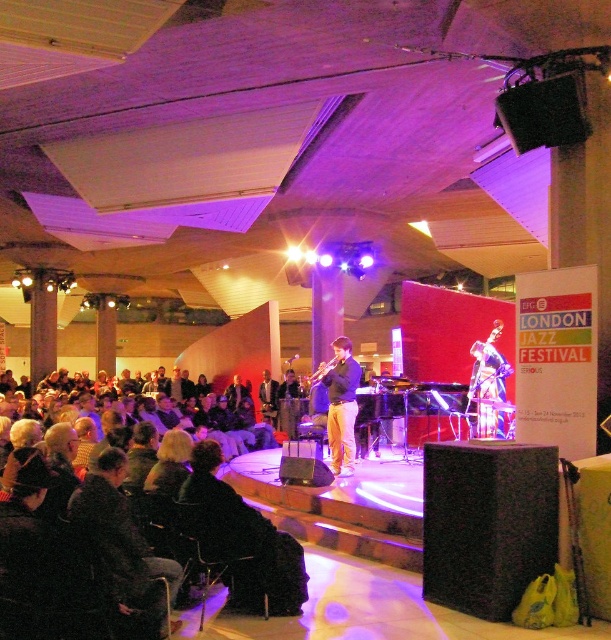
Question: Which object is positioned farthest from the light brown leather pants at center?

Choices:
 (A) dark brown leather jacket at center
 (B) dark brown leather jacket at lower left
 (C) shiny silver guitar at center
 (D) black textured speaker at center

Answer: (A)

Question: Does black textured speaker at center appear over shiny silver guitar at center?

Choices:
 (A) no
 (B) yes

Answer: (A)

Question: Which object appears closest to the camera in this image?

Choices:
 (A) dark brown leather jacket at lower left
 (B) dark brown leather jacket at center
 (C) light brown leather pants at center
 (D) black textured speaker at center

Answer: (A)

Question: Does black textured speaker at center have a lesser width compared to shiny silver guitar at center?

Choices:
 (A) yes
 (B) no

Answer: (B)

Question: Estimate the real-world distances between objects in this image. Which object is closer to the dark brown leather jacket at lower left?

Choices:
 (A) light brown leather pants at center
 (B) shiny silver guitar at center

Answer: (A)

Question: Can you confirm if black textured speaker at center is wider than light brown leather pants at center?

Choices:
 (A) no
 (B) yes

Answer: (B)